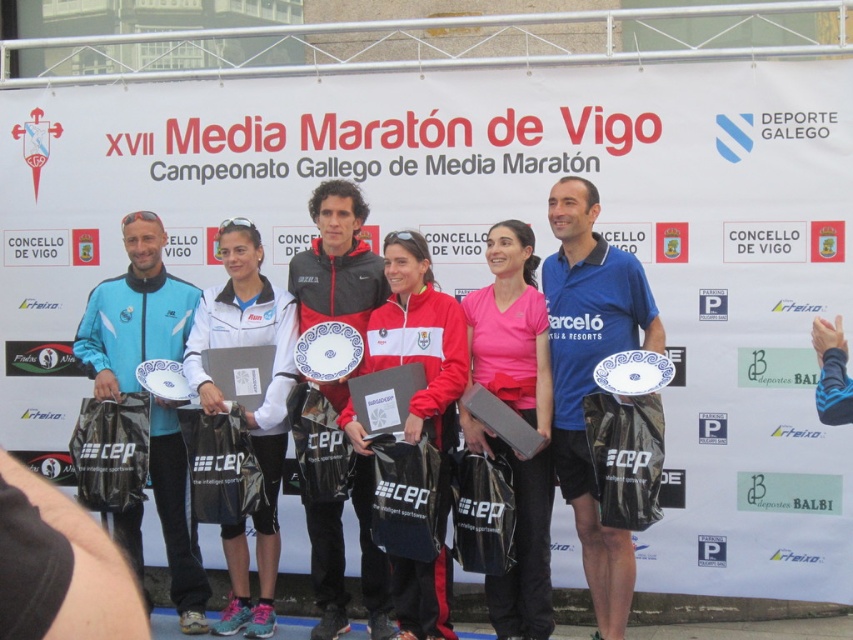
You are a photographer at the XVII Media Maratony de Vigo event. You need to capture a photo of the two athletes wearing the pink matte jersey at center and the light blue synthetic jacket at center. Which athlete is standing in front of the other?

The pink matte jersey at center is positioned over light blue synthetic jacket at center, so the athlete wearing the pink matte jersey at center is standing in front of the one wearing the light blue synthetic jacket at center.

You are a photographer at the XVII Media Maratony de Vigo. You need to capture a clear shot of both the pink matte jersey at center and the white matte jacket at center. Since the two items are at the same center position, which one will appear larger in the photo?

The pink matte jersey at center will appear larger in the photo because it is closer to the viewer than the white matte jacket at center.